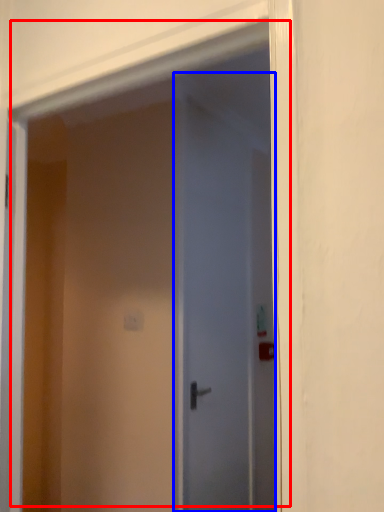
Question: Among these objects, which one is farthest to the camera, door (highlighted by a red box) or door (highlighted by a blue box)?

Choices:
 (A) door
 (B) door

Answer: (B)